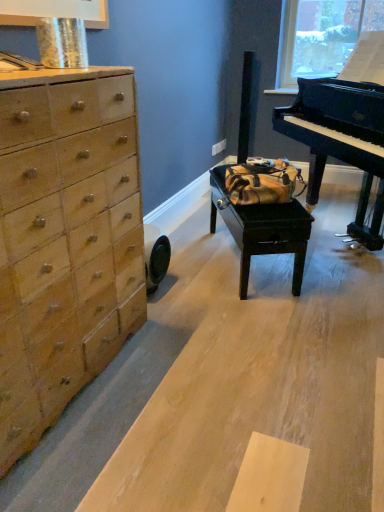
I want to click on vacant space that's between light brown wood chest of drawers at left and wooden table at center, so click(x=184, y=330).